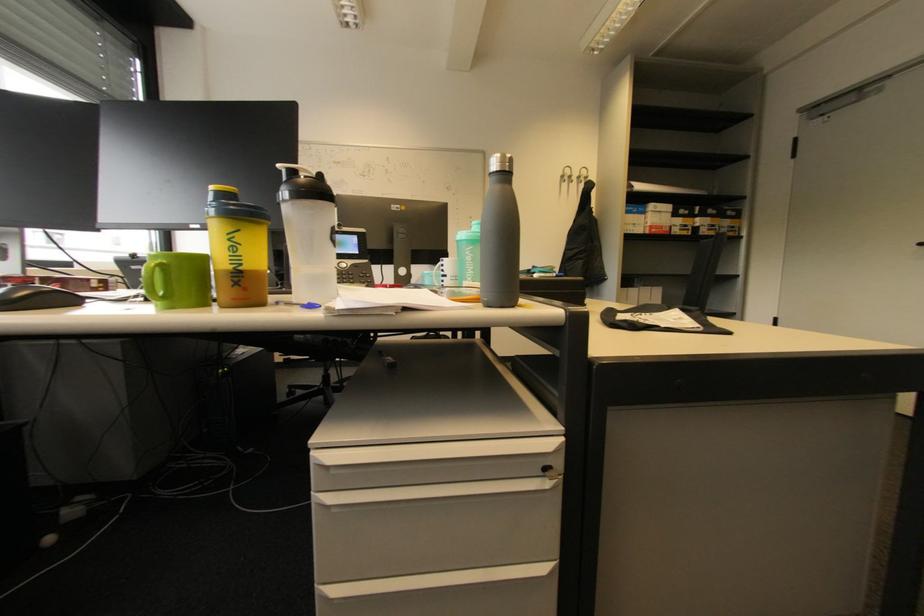
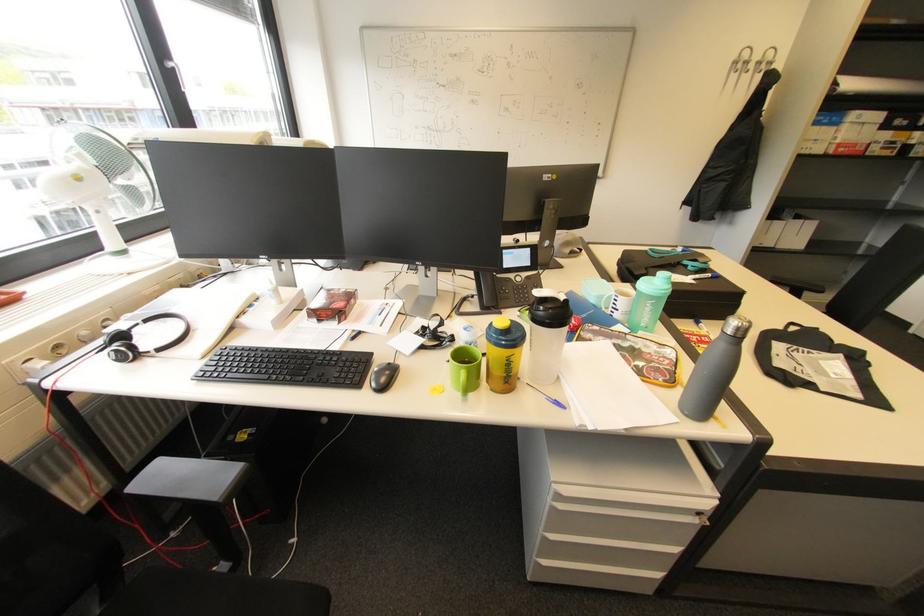
Locate, in the second image, the point that corresponds to point (573, 171) in the first image.

(751, 54)